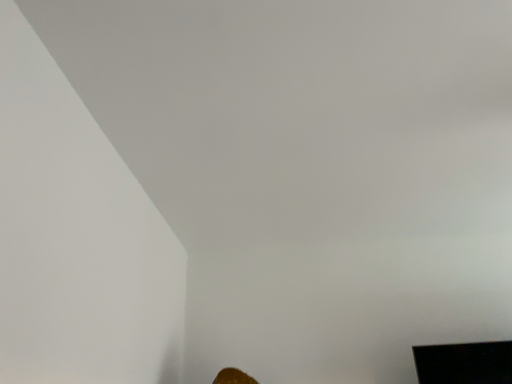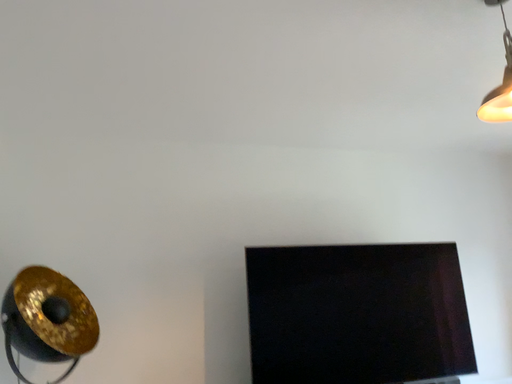
Question: Which way did the camera rotate in the video?

Choices:
 (A) rotated downward
 (B) rotated upward

Answer: (A)